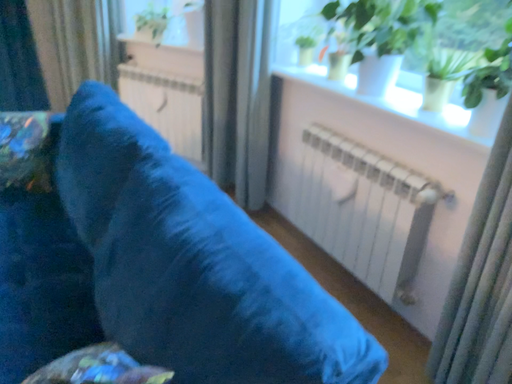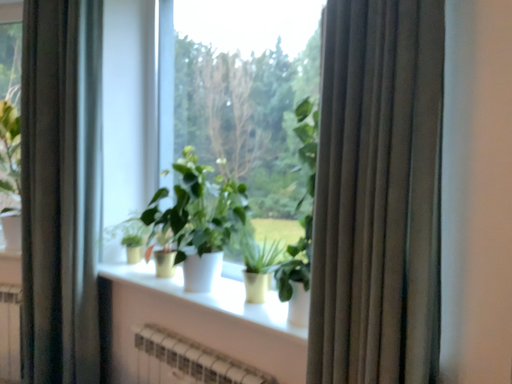
Question: How did the camera likely rotate when shooting the video?

Choices:
 (A) rotated downward
 (B) rotated upward

Answer: (B)